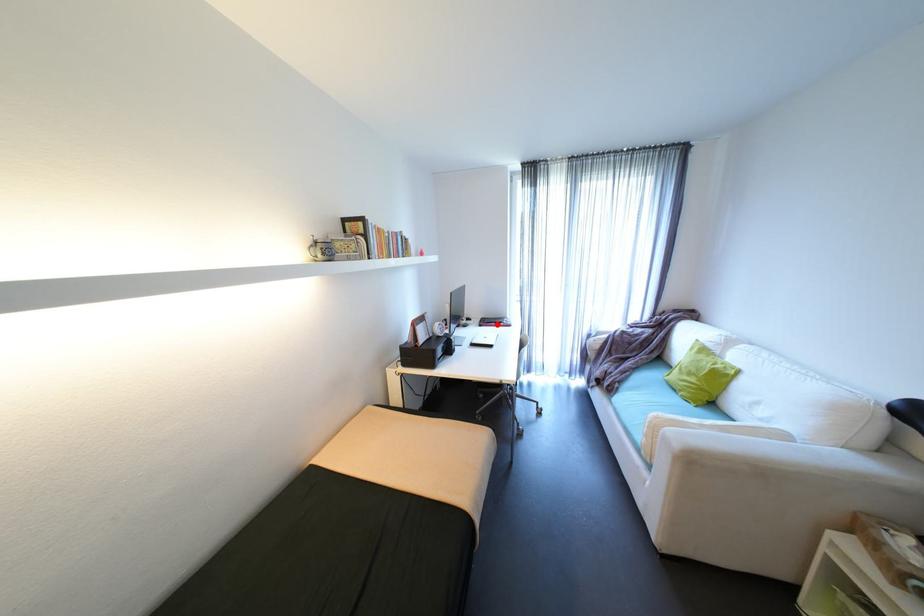
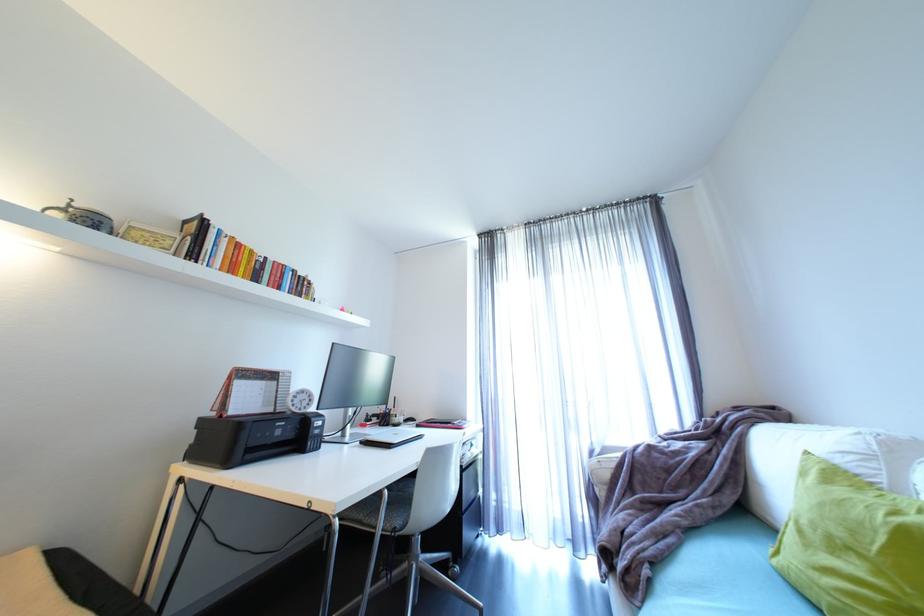
Find the pixel in the second image that matches the highlighted location in the first image.

(440, 424)